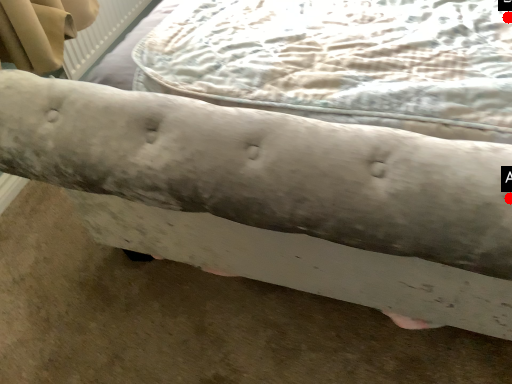
Question: Two points are circled on the image, labeled by A and B beside each circle. Which point is closer to the camera?

Choices:
 (A) A is closer
 (B) B is closer

Answer: (A)